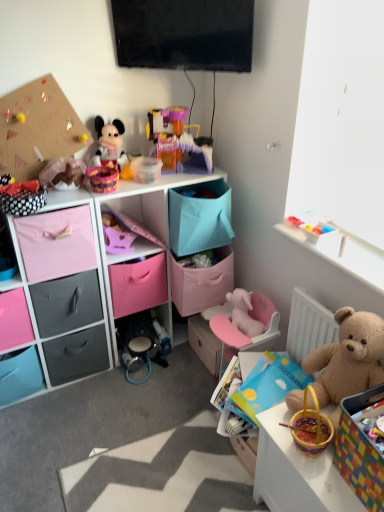
Find the location of a particular element. The image size is (384, 512). free spot to the right of pink fabric drawer at lower left, which appears as the seventh drawer when viewed from the right is located at coordinates (69, 404).